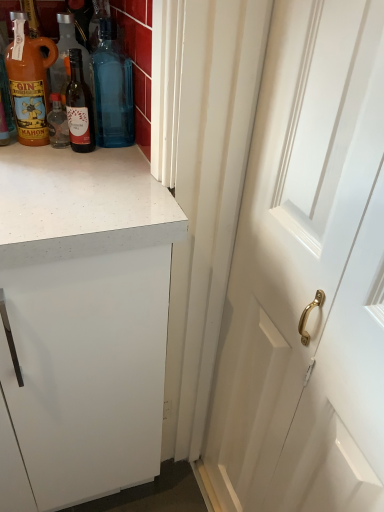
Question: Which direction should I rotate to face matte glass bottle at upper center, which is the 2th bottle in left-to-right order, — up or down?

Choices:
 (A) up
 (B) down

Answer: (A)

Question: From the image's perspective, is matte orange bottle at left, the 1th bottle when ordered from left to right, below blue glass bottle at upper center, which ranks as the first bottle in right-to-left order?

Choices:
 (A) yes
 (B) no

Answer: (A)

Question: From the image's perspective, is matte orange bottle at left, the third bottle in the right-to-left sequence, on top of blue glass bottle at upper center, which ranks as the first bottle in right-to-left order?

Choices:
 (A) yes
 (B) no

Answer: (B)

Question: Can we say matte orange bottle at left, the third bottle in the right-to-left sequence, lies outside blue glass bottle at upper center, which is counted as the 3th bottle, starting from the left?

Choices:
 (A) yes
 (B) no

Answer: (A)

Question: Is matte orange bottle at left, the third bottle in the right-to-left sequence, behind blue glass bottle at upper center, which ranks as the first bottle in right-to-left order?

Choices:
 (A) no
 (B) yes

Answer: (A)

Question: Does matte orange bottle at left, the 1th bottle when ordered from left to right, contain blue glass bottle at upper center, which ranks as the first bottle in right-to-left order?

Choices:
 (A) yes
 (B) no

Answer: (B)

Question: From a real-world perspective, is matte orange bottle at left, the 1th bottle when ordered from left to right, positioned under blue glass bottle at upper center, which ranks as the first bottle in right-to-left order, based on gravity?

Choices:
 (A) no
 (B) yes

Answer: (B)

Question: Is matte glass bottle at upper center, marked as the second bottle in a right-to-left arrangement, facing towards matte orange bottle at left, the 1th bottle when ordered from left to right?

Choices:
 (A) no
 (B) yes

Answer: (A)

Question: Is matte orange bottle at left, the third bottle in the right-to-left sequence, a part of matte glass bottle at upper center, marked as the second bottle in a right-to-left arrangement?

Choices:
 (A) no
 (B) yes

Answer: (A)

Question: From a real-world perspective, is matte glass bottle at upper center, marked as the second bottle in a right-to-left arrangement, under matte orange bottle at left, the third bottle in the right-to-left sequence?

Choices:
 (A) no
 (B) yes

Answer: (B)

Question: From the image's perspective, does matte glass bottle at upper center, which is the 2th bottle in left-to-right order, appear higher than matte orange bottle at left, the third bottle in the right-to-left sequence?

Choices:
 (A) no
 (B) yes

Answer: (A)

Question: From a real-world perspective, is matte glass bottle at upper center, which is the 2th bottle in left-to-right order, physically above matte orange bottle at left, the third bottle in the right-to-left sequence?

Choices:
 (A) yes
 (B) no

Answer: (B)

Question: Is matte glass bottle at upper center, marked as the second bottle in a right-to-left arrangement, located outside matte orange bottle at left, the 1th bottle when ordered from left to right?

Choices:
 (A) yes
 (B) no

Answer: (A)

Question: Is matte glass bottle at upper center, which is the 2th bottle in left-to-right order, bigger than white wooden door at right?

Choices:
 (A) no
 (B) yes

Answer: (A)